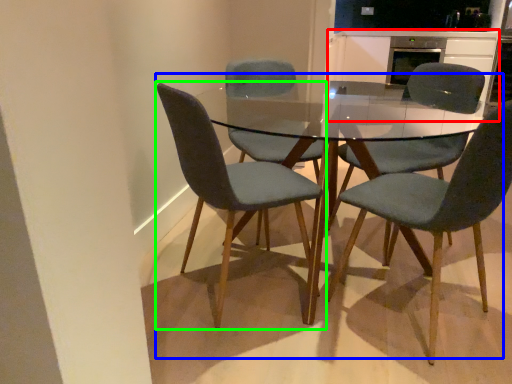
Question: Which object is positioned closest to cabinetry (highlighted by a red box)? Select from kitchen & dining room table (highlighted by a blue box) and chair (highlighted by a green box).

Choices:
 (A) kitchen & dining room table
 (B) chair

Answer: (A)